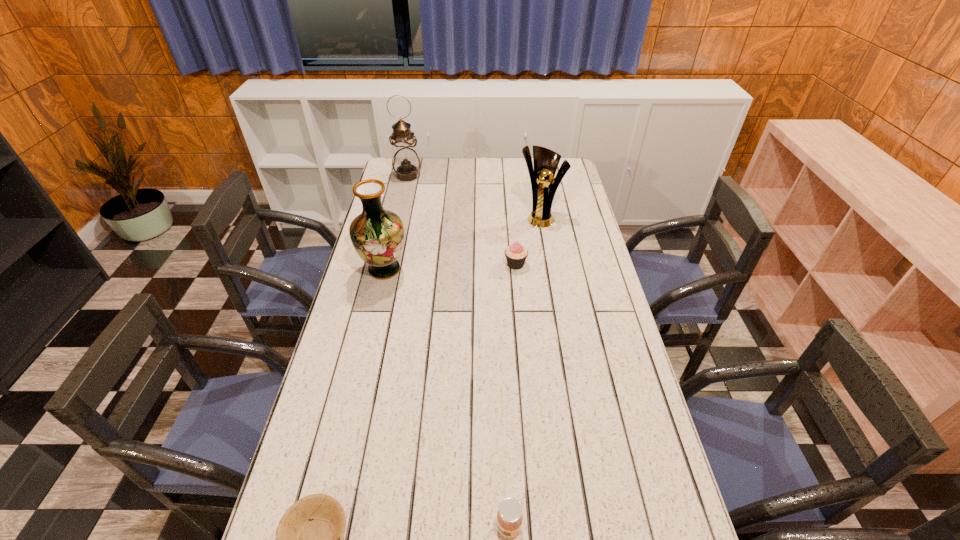
Where is `the farthest object`? This screenshot has width=960, height=540. the farthest object is located at coordinates (406, 163).

Where is `vase`? The width and height of the screenshot is (960, 540). vase is located at coordinates (377, 235).

The image size is (960, 540). Find the location of `award`. award is located at coordinates (544, 186).

This screenshot has height=540, width=960. Identify the location of cupcake. (516, 254).

You are a GUI agent. You are given a task and a screenshot of the screen. Output one action in this format:
    pyautogui.click(x=<x>, y=<y>)
    Task: Click on the vacant area located on the right of the oil lamp
    This screenshot has width=960, height=540.
    Given the screenshot: What is the action you would take?
    pyautogui.click(x=451, y=176)

At what (x,y) coordinates should I click in order to perform the action: click on vacant region located 0.160m on the back of the vase. Please return your answer as a coordinate pair (x, y). This screenshot has width=960, height=540. Looking at the image, I should click on (395, 228).

Where is `free space located at the front of the fifth nearest object, where the globe is visible`? The width and height of the screenshot is (960, 540). free space located at the front of the fifth nearest object, where the globe is visible is located at coordinates (551, 284).

The image size is (960, 540). Identify the location of free space located 0.090m on the left of the cupcake. (479, 264).

Locate an element on the screen. The height and width of the screenshot is (540, 960). object that is positioned at the far edge is located at coordinates (406, 163).

Where is `oil lamp that is at the left edge`? This screenshot has width=960, height=540. oil lamp that is at the left edge is located at coordinates (406, 163).